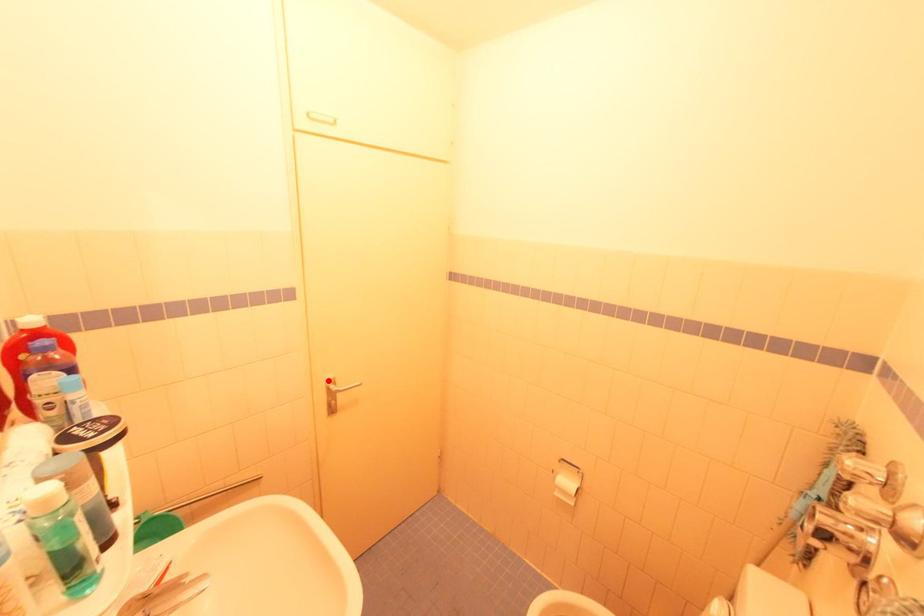
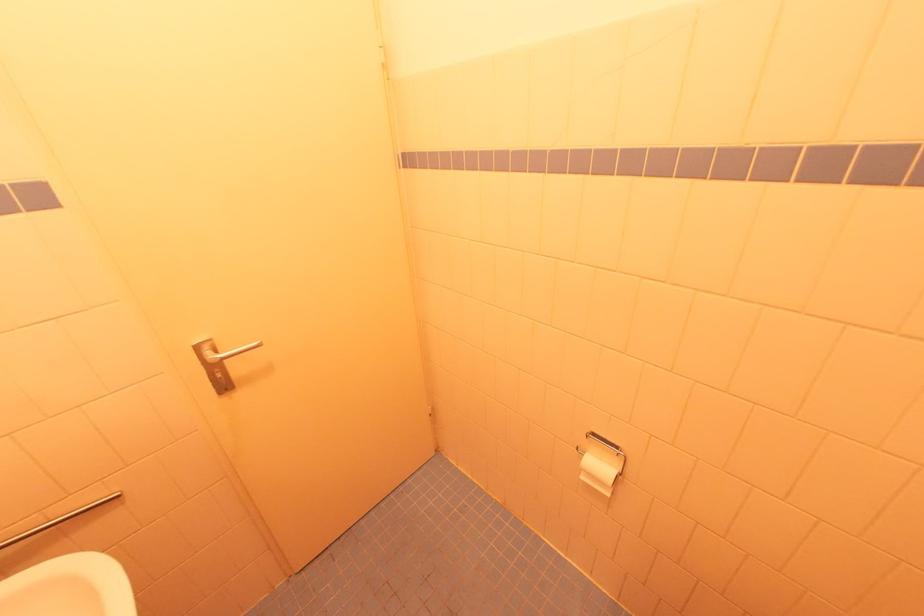
Locate, in the second image, the point that corresponds to the highlighted location in the first image.

(197, 345)